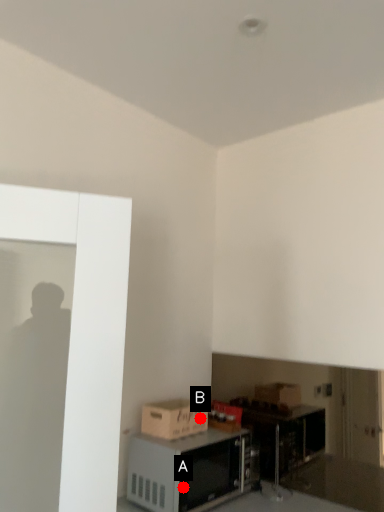
Question: Two points are circled on the image, labeled by A and B beside each circle. Among these points, which one is nearest to the camera?

Choices:
 (A) A is closer
 (B) B is closer

Answer: (A)